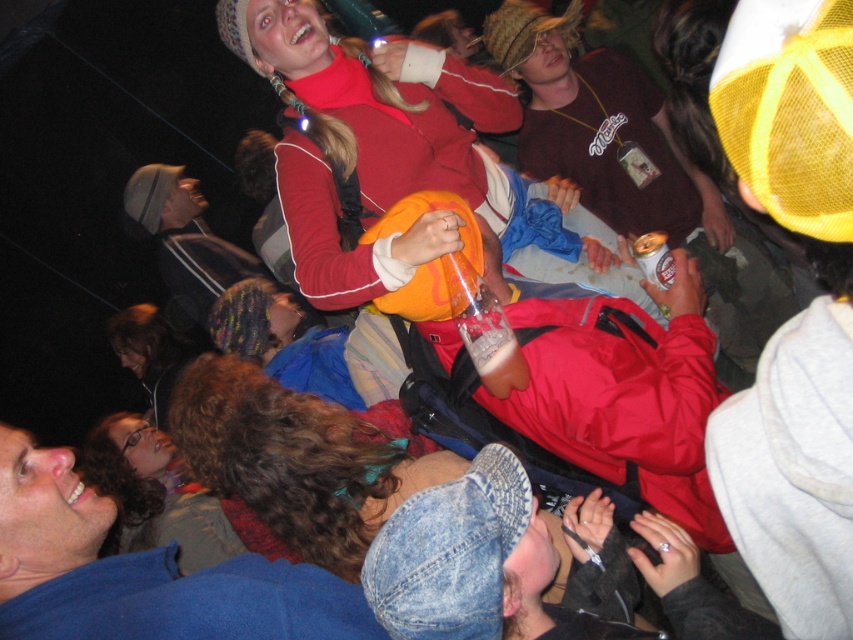
Is denim jacket at center to the right of striped knit hat at upper center from the viewer's perspective?

Indeed, denim jacket at center is positioned on the right side of striped knit hat at upper center.

This screenshot has height=640, width=853. What do you see at coordinates (289, 408) in the screenshot?
I see `denim jacket at center` at bounding box center [289, 408].

Where is `denim jacket at center`? The image size is (853, 640). denim jacket at center is located at coordinates (289, 408).

Where is `denim jacket at center`? denim jacket at center is located at coordinates (289, 408).

Does matte brown shirt at center lie in front of denim jacket at center?

No, it is not.

Describe the element at coordinates (590, 122) in the screenshot. The image size is (853, 640). I see `matte brown shirt at center` at that location.

Locate an element on the screen. Image resolution: width=853 pixels, height=640 pixels. matte brown shirt at center is located at coordinates (590, 122).

Which is in front, point (181, 262) or point (654, 284)?

Point (654, 284)

Is point (204, 275) positioned in front of point (648, 252)?

No, it is behind (648, 252).

Where is `striped knit hat at upper center`? The width and height of the screenshot is (853, 640). striped knit hat at upper center is located at coordinates (184, 237).